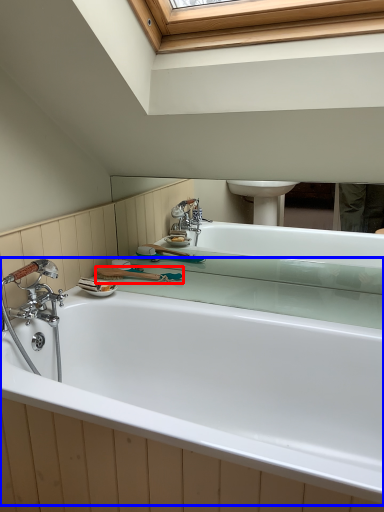
Question: Which object is closer to the camera taking this photo, shower (highlighted by a red box) or bathtub (highlighted by a blue box)?

Choices:
 (A) shower
 (B) bathtub

Answer: (B)